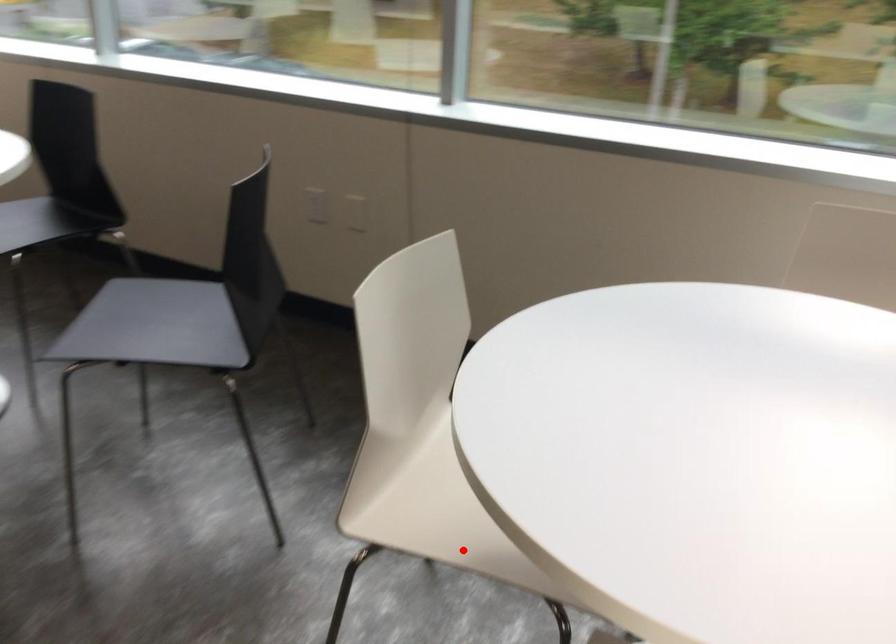
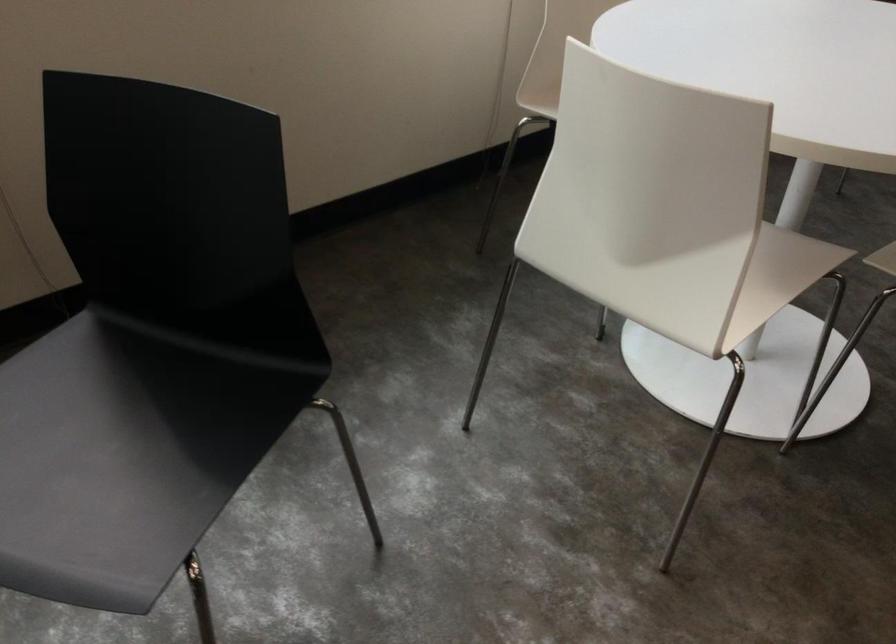
Question: I am providing you with two images of the same scene from different viewpoints. Given a red point in image1, look at the same physical point in image2. Is it:

Choices:
 (A) Closer to the viewpoint
 (B) Farther from the viewpoint

Answer: (B)